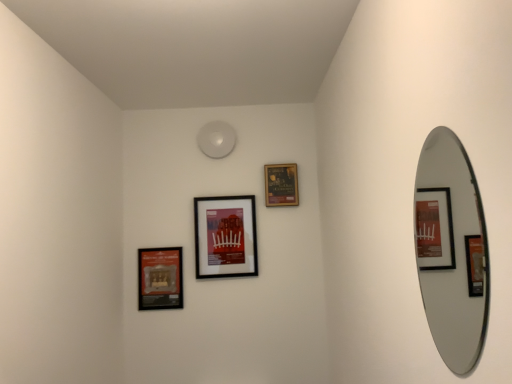
Question: From a real-world perspective, is matte black picture frame at center, the second picture frame positioned from the left, above or below silver metallic mirror at right?

Choices:
 (A) above
 (B) below

Answer: (A)

Question: Is matte black picture frame at center, the second picture frame positioned from the left, situated inside silver metallic mirror at right or outside?

Choices:
 (A) outside
 (B) inside

Answer: (A)

Question: Considering the real-world distances, which object is closest to the silver metallic mirror at right?

Choices:
 (A) matte black picture frame at center, the 2th picture frame when ordered from right to left
 (B) matte black picture frame at lower left, the 3th picture frame from the right
 (C) matte black picture frame at upper center, arranged as the 3th picture frame when viewed from the left

Answer: (C)

Question: Which of these objects is positioned farthest from the silver metallic mirror at right?

Choices:
 (A) matte black picture frame at upper center, arranged as the 3th picture frame when viewed from the left
 (B) matte black picture frame at lower left, the 3th picture frame from the right
 (C) matte black picture frame at center, the second picture frame positioned from the left

Answer: (B)